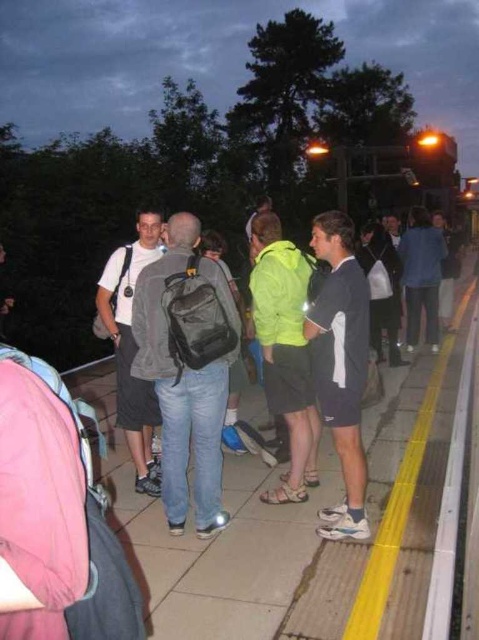
You are a delivery person who needs to place a small package on the matte gray pavement at center. However, there is a dark blue jersey at center in the way. Can you place the package there without moving the jersey?

The matte gray pavement at center is shorter than the dark blue jersey at center, so the jersey is taller than the pavement. This means the jersey is likely resting on top of the pavement, making it impossible to place the package directly on the pavement without moving the jersey.